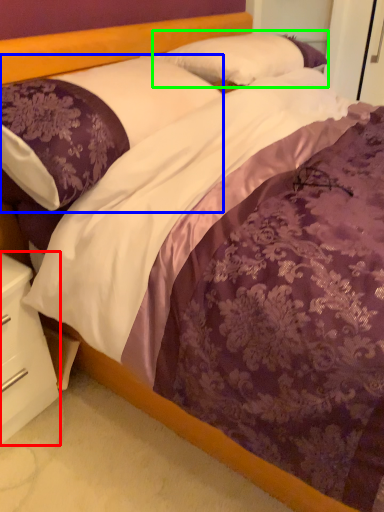
Question: Considering the real-world distances, which object is farthest from nightstand (highlighted by a red box)? pillow (highlighted by a blue box) or pillow (highlighted by a green box)?

Choices:
 (A) pillow
 (B) pillow

Answer: (B)